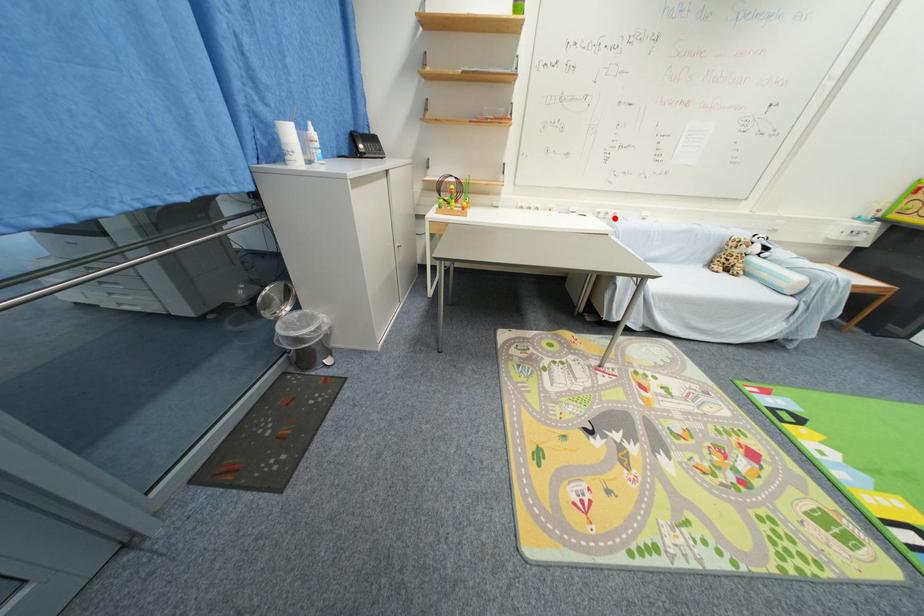
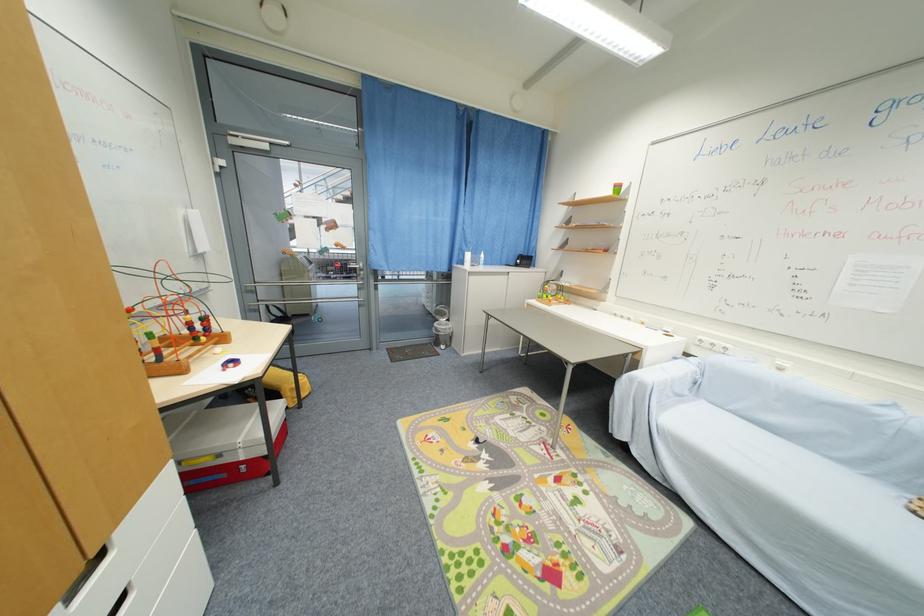
In the second image, find the point that corresponds to the highlighted location in the first image.

(723, 351)